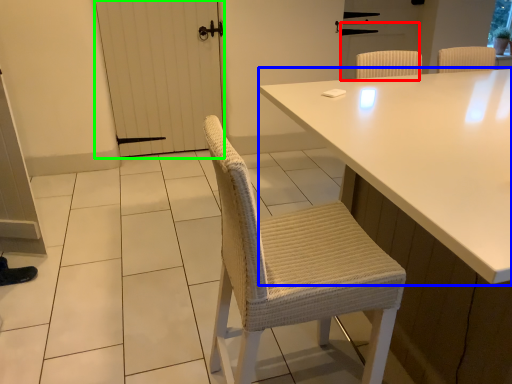
Question: Considering the real-world distances, which object is closest to screen door (highlighted by a red box)? table (highlighted by a blue box) or screen door (highlighted by a green box).

Choices:
 (A) table
 (B) screen door

Answer: (B)